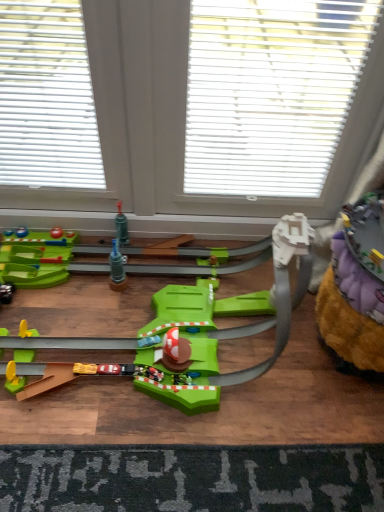
Locate an element on the screen. This screenshot has height=512, width=384. free space to the back side of dark gray textured mat at lower center is located at coordinates (220, 366).